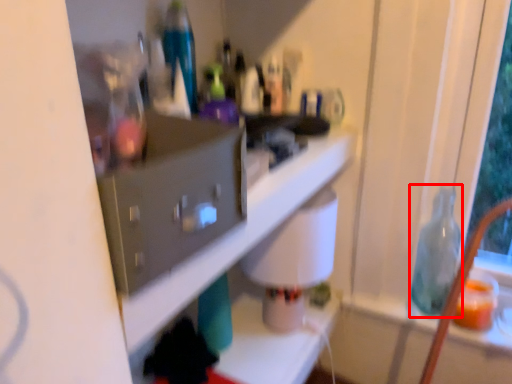
Question: From the image's perspective, where is bottle (annotated by the red box) located in relation to shelf in the image?

Choices:
 (A) above
 (B) below

Answer: (B)